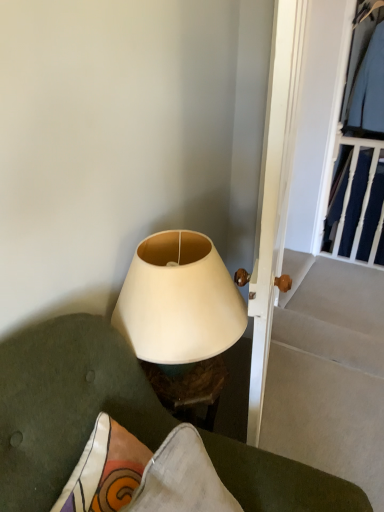
Question: From a real-world perspective, is dark blue fabric at upper right, positioned as the first clothing in bottom-to-top order, located higher than white wooden door at center?

Choices:
 (A) no
 (B) yes

Answer: (A)

Question: Does dark blue fabric at upper right, the second clothing from the top, lie behind white wooden door at center?

Choices:
 (A) no
 (B) yes

Answer: (B)

Question: From the image's perspective, is dark blue fabric at upper right, positioned as the first clothing in bottom-to-top order, on white wooden door at center?

Choices:
 (A) no
 (B) yes

Answer: (B)

Question: Can you confirm if dark blue fabric at upper right, positioned as the first clothing in bottom-to-top order, is thinner than white wooden door at center?

Choices:
 (A) no
 (B) yes

Answer: (B)

Question: Does dark blue fabric at upper right, the second clothing from the top, contain white wooden door at center?

Choices:
 (A) yes
 (B) no

Answer: (B)

Question: Which is correct: white matte lampshade at center is inside matte white lampshade at center, or outside of it?

Choices:
 (A) inside
 (B) outside

Answer: (B)

Question: In the image, is white matte lampshade at center on the left side or the right side of matte white lampshade at center?

Choices:
 (A) left
 (B) right

Answer: (A)

Question: Relative to matte white lampshade at center, is white matte lampshade at center in front or behind?

Choices:
 (A) behind
 (B) front

Answer: (A)

Question: From a real-world perspective, is white matte lampshade at center physically located above or below matte white lampshade at center?

Choices:
 (A) below
 (B) above

Answer: (B)

Question: Looking at the image, does light blue fabric shirt at upper right, which ranks as the 1th clothing in top-to-bottom order, seem bigger or smaller compared to white matte lampshade at center?

Choices:
 (A) small
 (B) big

Answer: (B)

Question: From the image's perspective, is light blue fabric shirt at upper right, which ranks as the 1th clothing in top-to-bottom order, positioned above or below white matte lampshade at center?

Choices:
 (A) below
 (B) above

Answer: (B)

Question: Choose the correct answer: Is light blue fabric shirt at upper right, which ranks as the 1th clothing in top-to-bottom order, inside white matte lampshade at center or outside it?

Choices:
 (A) outside
 (B) inside

Answer: (A)

Question: Is light blue fabric shirt at upper right, which ranks as the 1th clothing in top-to-bottom order, taller or shorter than white matte lampshade at center?

Choices:
 (A) tall
 (B) short

Answer: (A)

Question: Considering the positions of light blue fabric shirt at upper right, arranged as the second clothing when ordered from the bottom, and dark blue fabric at upper right, positioned as the first clothing in bottom-to-top order, in the image, is light blue fabric shirt at upper right, arranged as the second clothing when ordered from the bottom, bigger or smaller than dark blue fabric at upper right, positioned as the first clothing in bottom-to-top order,?

Choices:
 (A) small
 (B) big

Answer: (B)

Question: From a real-world perspective, is light blue fabric shirt at upper right, arranged as the second clothing when ordered from the bottom, positioned above or below dark blue fabric at upper right, positioned as the first clothing in bottom-to-top order?

Choices:
 (A) below
 (B) above

Answer: (B)